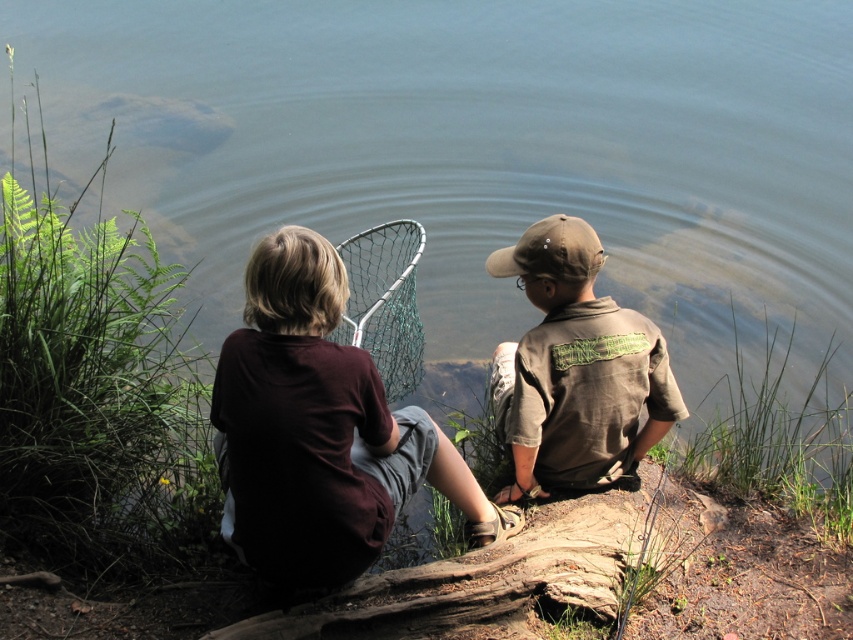
You are a photographer trying to capture a clear shot of the dark brown shirt at center and the green mesh fishing net at center. Since you want both subjects to be in focus, you need to know which one is taller. Can you determine which object is taller?

The dark brown shirt at center is taller than the green mesh fishing net at center, so you should adjust your camera focus to accommodate its height.

You are a photographer trying to capture a photo of the dark brown shirt at center and the brown rough wood log at lower center. Based on their positions, which object should you focus on first if you want to include both in the frame without moving the camera?

The dark brown shirt at center is to the left of brown rough wood log at lower center, so you should focus on the dark brown shirt at center first to ensure both are in frame without moving the camera.

You are a photographer trying to capture a photo of the brown rough wood log at lower center and the green mesh fishing net at center. Based on their positions, which object should you adjust your camera focus on first if you want to ensure both are in the frame?

The brown rough wood log at lower center is to the right of the green mesh fishing net at center, so you should focus on the green mesh fishing net at center first to ensure both are within the frame.